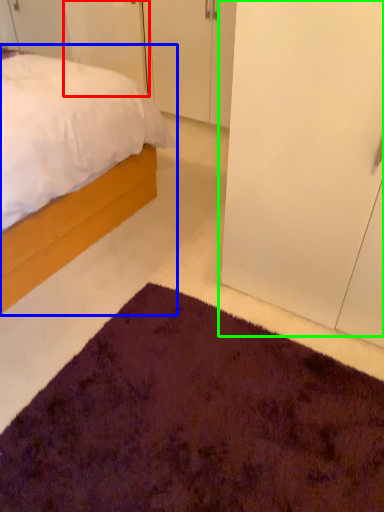
Question: Based on their relative distances, which object is nearer to door (highlighted by a red box)? Choose from bed (highlighted by a blue box) and glass door (highlighted by a green box).

Choices:
 (A) bed
 (B) glass door

Answer: (A)